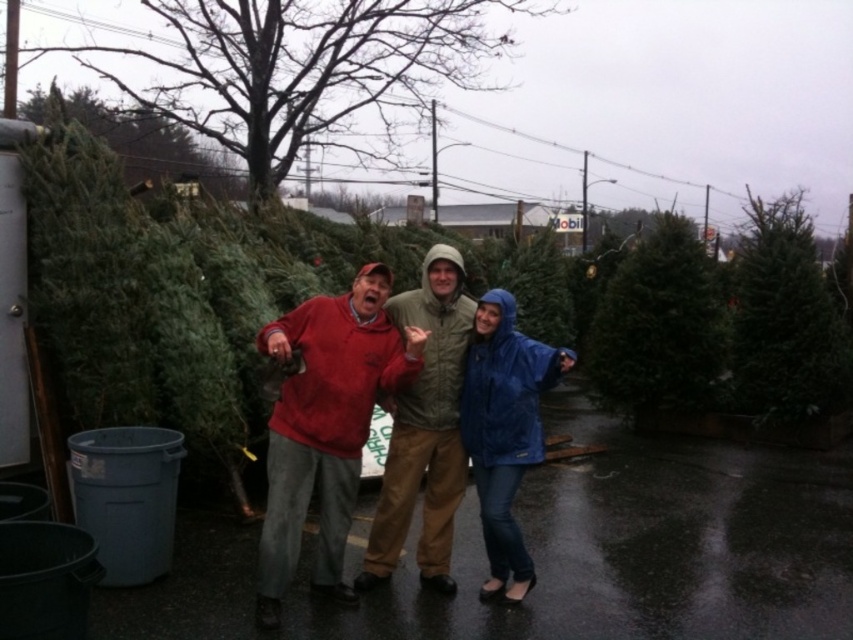
Consider the image. You are a delivery person who needs to transport both the green matte christmas tree at right and the blue waterproof jacket at center to a customer. The truck has a loading area with a height limit of 1.8 meters. Can both items be loaded without exceeding the height limit?

The green matte christmas tree at right is bigger than the blue waterproof jacket at center, but the exact height of the tree is not specified. Therefore, it is uncertain whether it will exceed the 1.8 meters height limit. Further measurement is required to confirm.

You are a delivery person trying to navigate between the green matte christmas tree at right and the green matte christmas tree at upper right. Which tree is closer to you, and can you walk around behind the closer one?

The green matte christmas tree at right is closer to you. Since the green matte christmas tree at upper right is behind it, you cannot walk around behind the closer one without moving past the front tree first.